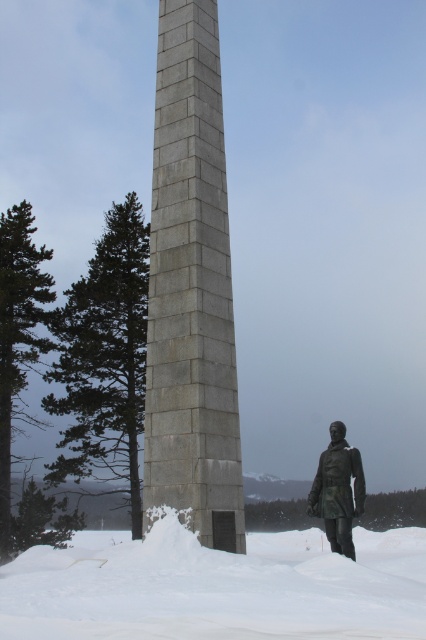
Question: Observing the image, what is the correct spatial positioning of gray stone obelisk at center in reference to bronze statue at lower right?

Choices:
 (A) left
 (B) right

Answer: (A)

Question: Can you confirm if gray stone obelisk at center is positioned below bronze statue at lower right?

Choices:
 (A) yes
 (B) no

Answer: (B)

Question: Which of these objects is positioned farthest from the bronze statue at lower right?

Choices:
 (A) gray stone obelisk at center
 (B) white fluffy snow at lower center

Answer: (B)

Question: Which point is farther to the camera?

Choices:
 (A) (172, 627)
 (B) (354, 476)
 (C) (218, 138)

Answer: (C)

Question: Which of these objects is positioned farthest from the white fluffy snow at lower center?

Choices:
 (A) gray stone obelisk at center
 (B) bronze statue at lower right

Answer: (B)

Question: Does gray stone obelisk at center appear over white fluffy snow at lower center?

Choices:
 (A) no
 (B) yes

Answer: (B)